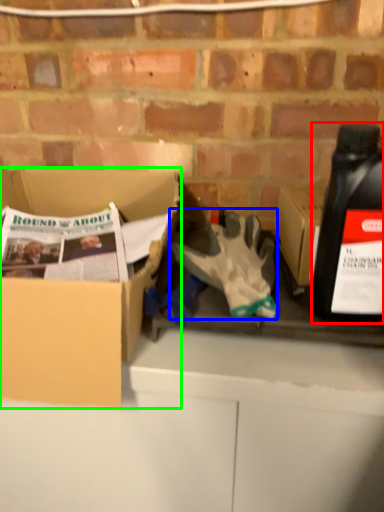
Question: Which object is positioned farthest from bottle (highlighted by a red box)? Select from glove (highlighted by a blue box) and box (highlighted by a green box).

Choices:
 (A) glove
 (B) box

Answer: (B)